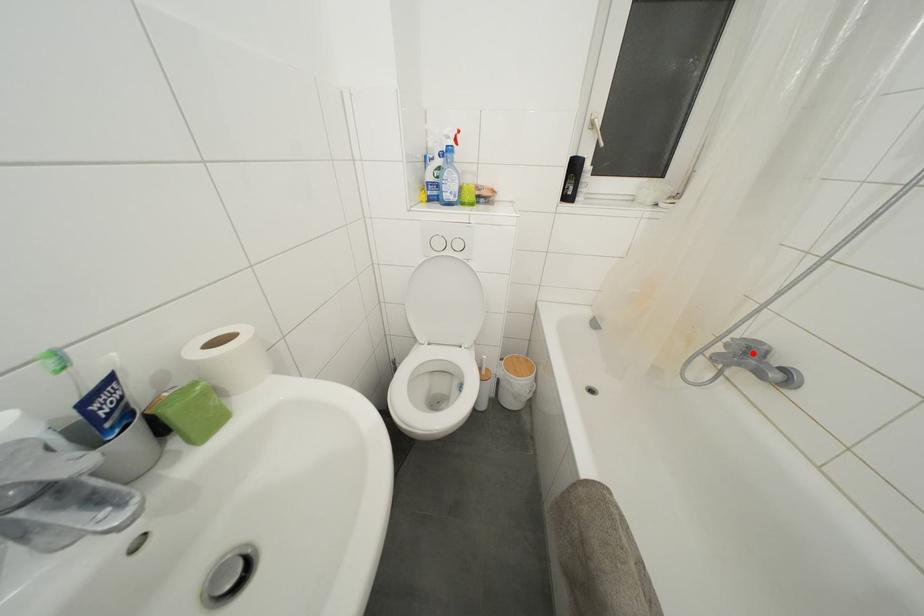
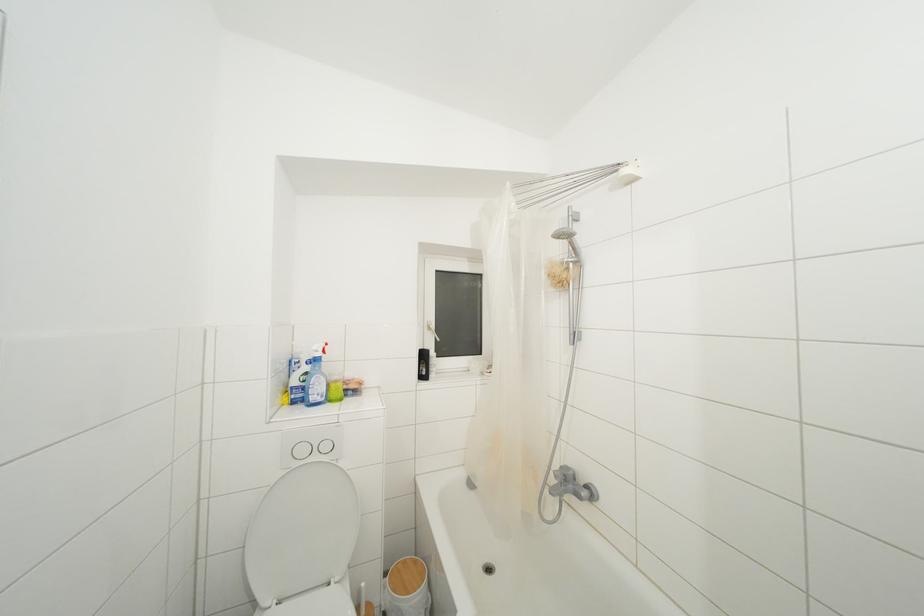
Question: I am providing you with two images of the same scene from different viewpoints. In image1, a red point is highlighted. Considering the same 3D point in image2, which of the following is correct?

Choices:
 (A) It is closer
 (B) It is farther

Answer: (B)